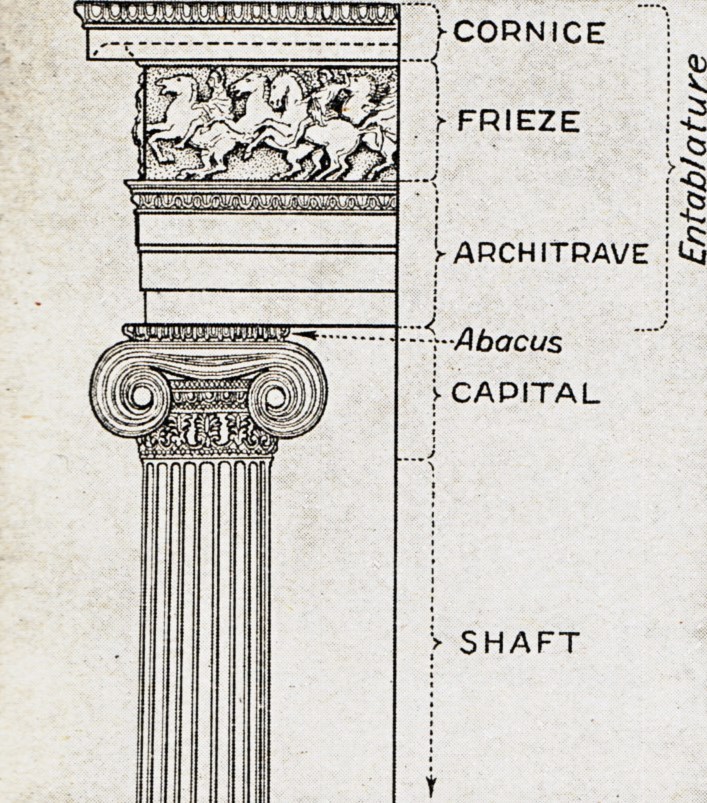
At what (x,y) coordinates should I click in order to perform the action: click on architrave. Please return your answer as a coordinate pair (x, y). The height and width of the screenshot is (803, 707). Looking at the image, I should click on (327, 231).